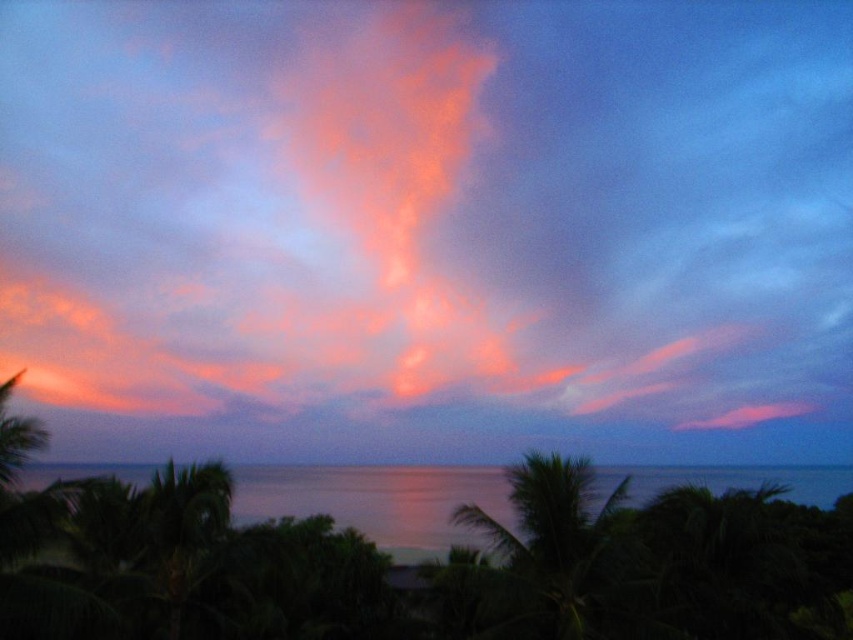
Question: Is glossy water at center to the right of green leafy palm tree at center from the viewer's perspective?

Choices:
 (A) no
 (B) yes

Answer: (B)

Question: Among these objects, which one is farthest from the camera?

Choices:
 (A) glossy water at center
 (B) vivid orange cloud at center
 (C) green leafy palm tree at center

Answer: (B)

Question: Is glossy water at center thinner than green leafy palm tree at center?

Choices:
 (A) no
 (B) yes

Answer: (A)

Question: Does vivid orange cloud at center appear under green leafy palm tree at center?

Choices:
 (A) yes
 (B) no

Answer: (B)

Question: Which object is positioned closest to the green leafy palm tree at center?

Choices:
 (A) glossy water at center
 (B) vivid orange cloud at center

Answer: (A)

Question: Considering the real-world distances, which object is farthest from the glossy water at center?

Choices:
 (A) vivid orange cloud at center
 (B) green leafy palm tree at center

Answer: (B)